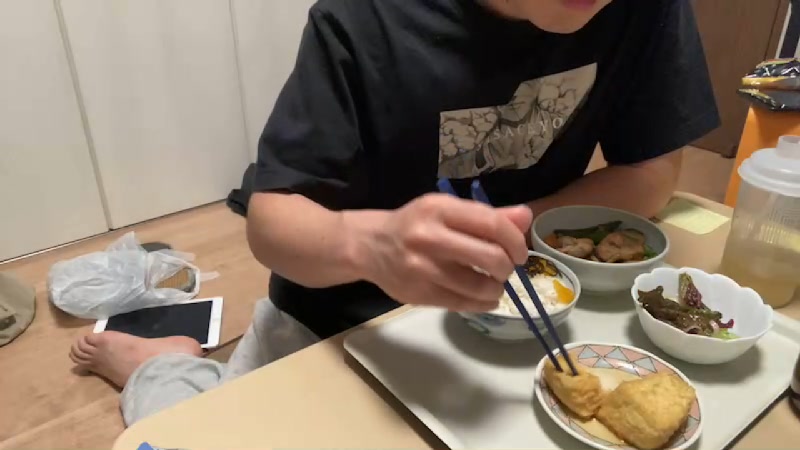
This screenshot has width=800, height=450. I want to click on chop stick, so click(526, 300).